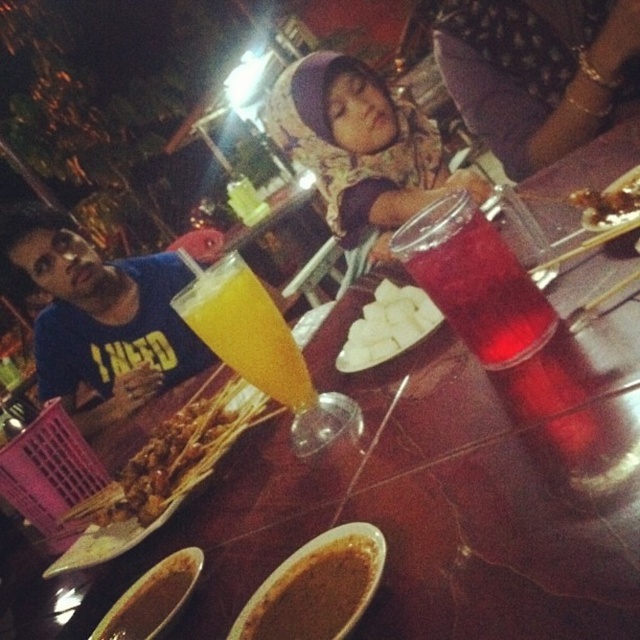
Question: Which object appears closest to the camera in this image?

Choices:
 (A) translucent glass juice at center
 (B) brown matte sauce at lower center
 (C) grilled meat skewers at center

Answer: (B)

Question: Among these objects, which one is farthest from the camera?

Choices:
 (A) savory skewers at center
 (B) blue jersey at left

Answer: (B)

Question: Which point is farther from the camera taking this photo?

Choices:
 (A) (253, 614)
 (B) (125, 275)
 (C) (148, 595)

Answer: (B)

Question: In this image, where is blue jersey at left located relative to savory skewers at center?

Choices:
 (A) left
 (B) right

Answer: (A)

Question: Is the position of translucent glass juice at center less distant than that of savory skewers at center?

Choices:
 (A) no
 (B) yes

Answer: (A)

Question: Is purple fabric headscarf at upper center further to the viewer compared to grilled meat skewers at center?

Choices:
 (A) no
 (B) yes

Answer: (B)